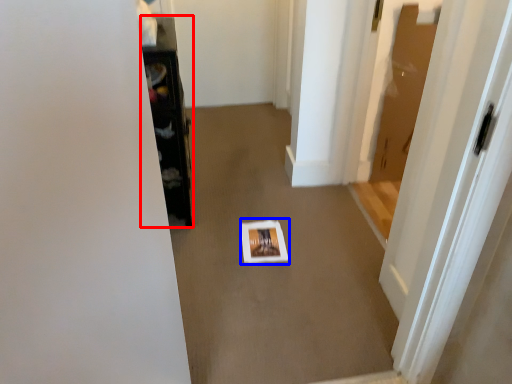
Question: Which point is closer to the camera, furniture (highlighted by a red box) or square (highlighted by a blue box)?

Choices:
 (A) furniture
 (B) square

Answer: (A)